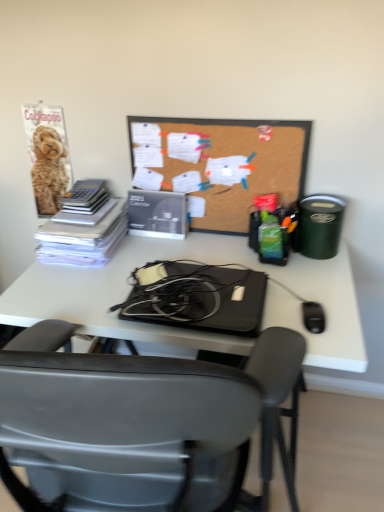
The image size is (384, 512). I want to click on unoccupied area behind black matte laptop at center, so click(196, 249).